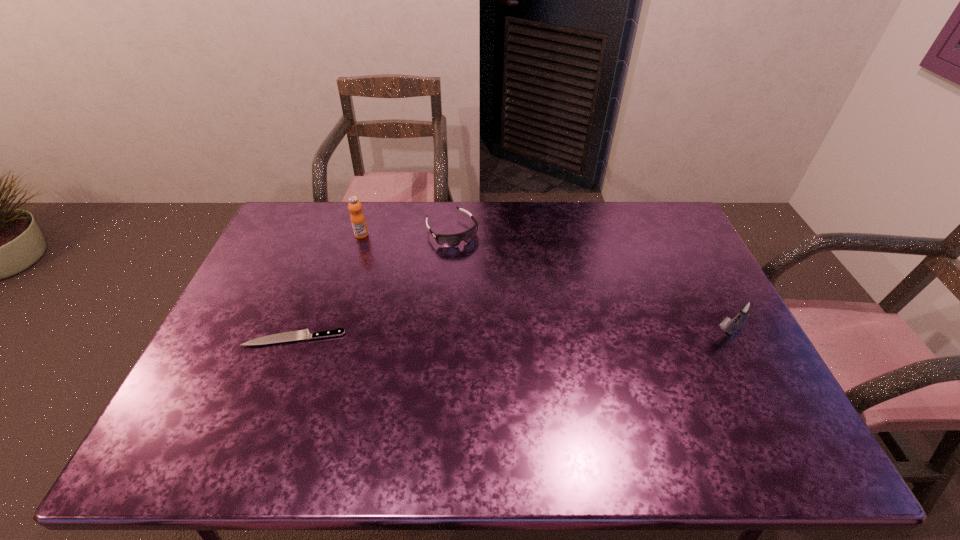
This screenshot has width=960, height=540. What are the coordinates of `the shortest object` in the screenshot? It's located at (299, 334).

Find the location of `the rightmost object`. the rightmost object is located at coordinates (747, 308).

Where is `the third shortest object`? the third shortest object is located at coordinates (747, 308).

You are a GUI agent. You are given a task and a screenshot of the screen. Output one action in this format:
    pyautogui.click(x=<x>, y=<y>)
    Task: Click on the second object from right to left
    The width and height of the screenshot is (960, 540).
    Given the screenshot: What is the action you would take?
    pos(452,240)

Where is `goggles`? goggles is located at coordinates (452, 240).

Image resolution: width=960 pixels, height=540 pixels. In order to click on the tallest object in this screenshot , I will do tap(357, 218).

Identify the location of vacant region located on the front of the steak knife. (264, 418).

The image size is (960, 540). I want to click on blank space located 0.100m on the front of the igniter, so click(x=749, y=377).

At what (x,y) coordinates should I click in order to perform the action: click on free space located on the front and sides of the goggles. Please return your answer as a coordinate pair (x, y). The height and width of the screenshot is (540, 960). Looking at the image, I should click on (489, 281).

I want to click on vacant position located on the front and sides of the goggles, so [x=493, y=287].